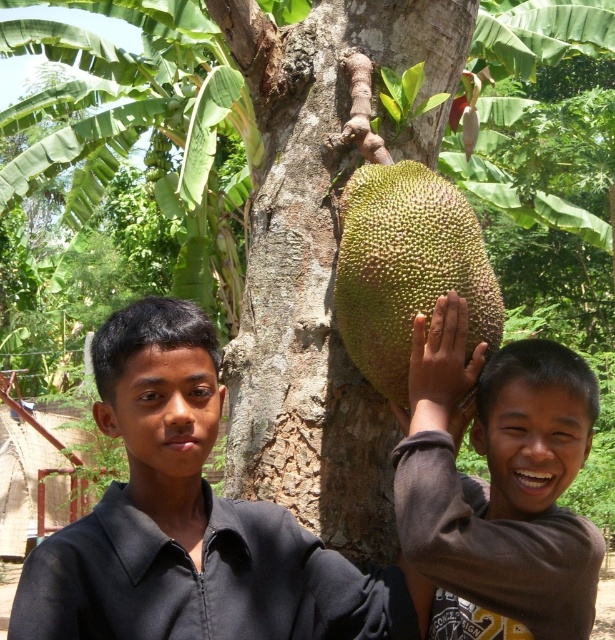
Based on the photo, you are a photographer trying to capture both the black matte shirt at left and the green spiky jackfruit at center in a single frame. Based on their sizes, which object should you focus on to ensure both fit clearly in the photo?

The black matte shirt at left is wider than the green spiky jackfruit at center, so you should focus on the black matte shirt at left to ensure both fit clearly in the photo.

You are a photographer trying to capture the brown matte jackfruit at center in your shot. The camera has a rectangular viewfinder with coordinates from 0 to 1 on both axes. The center of the viewfinder is at point 0.5, 0.5. Where should you position the camera to ensure the jackfruit is at the center of the viewfinder?

To center the brown matte jackfruit at center in the viewfinder, move the camera so that the jackfruit is positioned at the center coordinates (307,320). The current position is at (496,483), so you need to adjust the camera to the left and down to bring it to (307,320).

You are standing in front of the jackfruit tree and see two points marked on the image. Which point is closer to you, point (435, 333) or point (405, 232)?

Point (435, 333) is in front of point (405, 232), so it is closer to you.